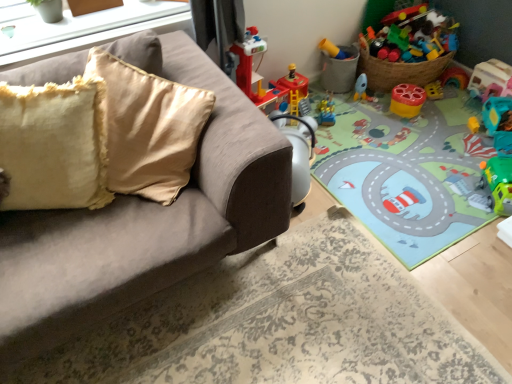
Identify the location of empty space that is in between matte plastic bucket at upper right, which ranks as the fifth toy in right-to-left order, and translucent plastic toy at center, the 1th toy positioned from the left. This screenshot has width=512, height=384. (335, 102).